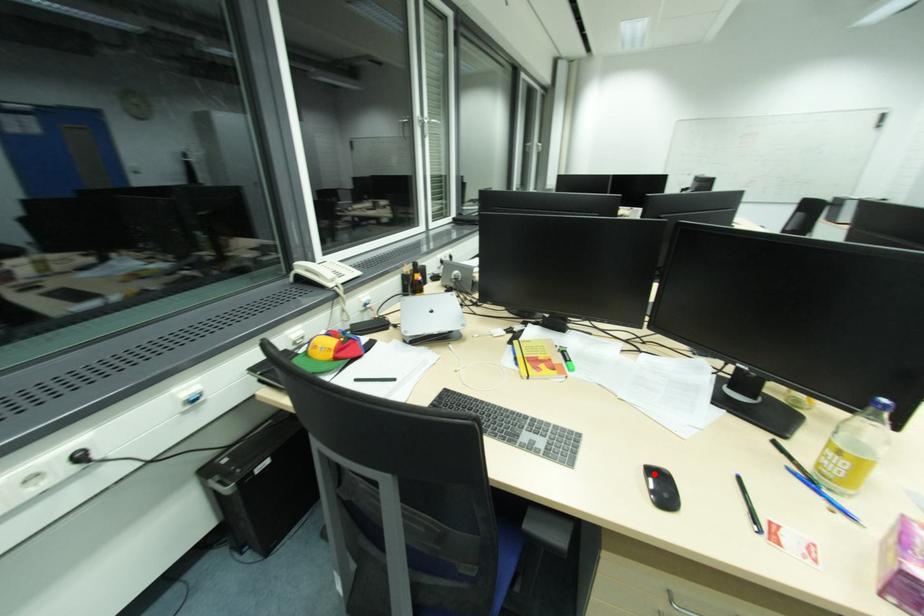
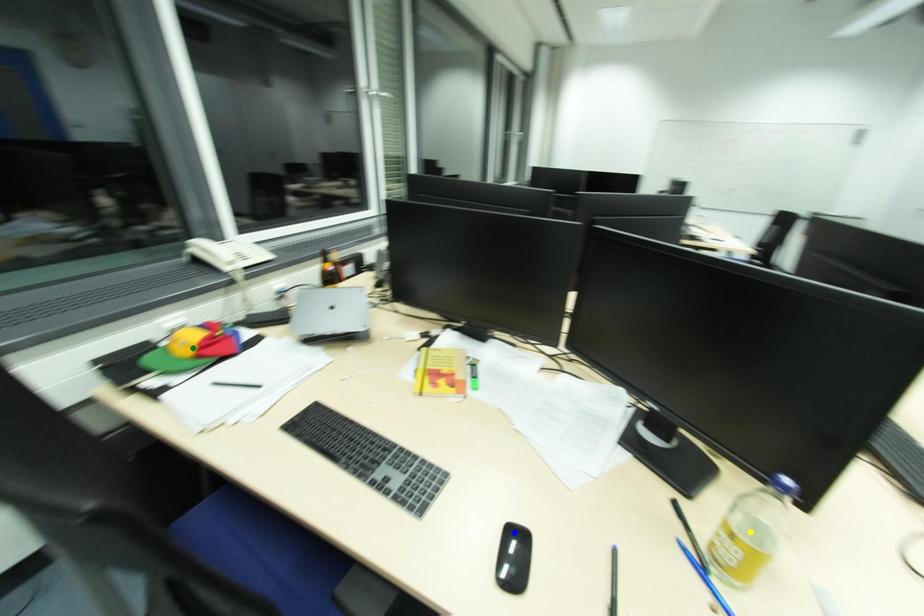
Question: I am providing you with two images of the same scene from different viewpoints. A red point is marked on the first image. You are given multiple points on the second image. Which point in image 2 is actually the same real-world point as the red point in image 1?

Choices:
 (A) blue point
 (B) yellow point
 (C) green point

Answer: (A)